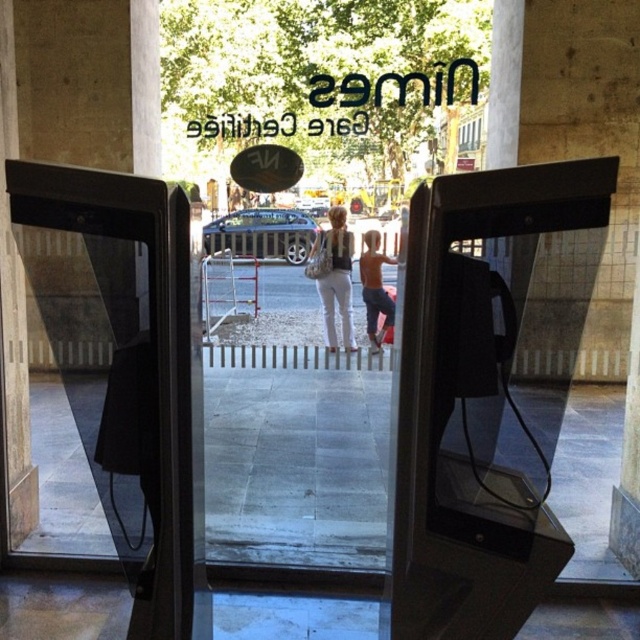
You are a security guard at Gare Centrale. You notice two people outside the entrance through the glass door. One is wearing white cotton pants at center and the other shiny metallic shorts at center. Which person is closer to the glass door?

The white cotton pants at center is closer to the glass door because the shiny metallic shorts at center is behind it.

You are standing inside Gare Centrale and looking through the glass door. You see a woman wearing white cotton pants at center outside. If you want to wave to her, will she be able to see your hand gesture from your current position?

The white cotton pants at center is 25.50 feet away from the viewer. Since the distance is quite far, it might be difficult for the woman to clearly see your hand gesture from that distance.